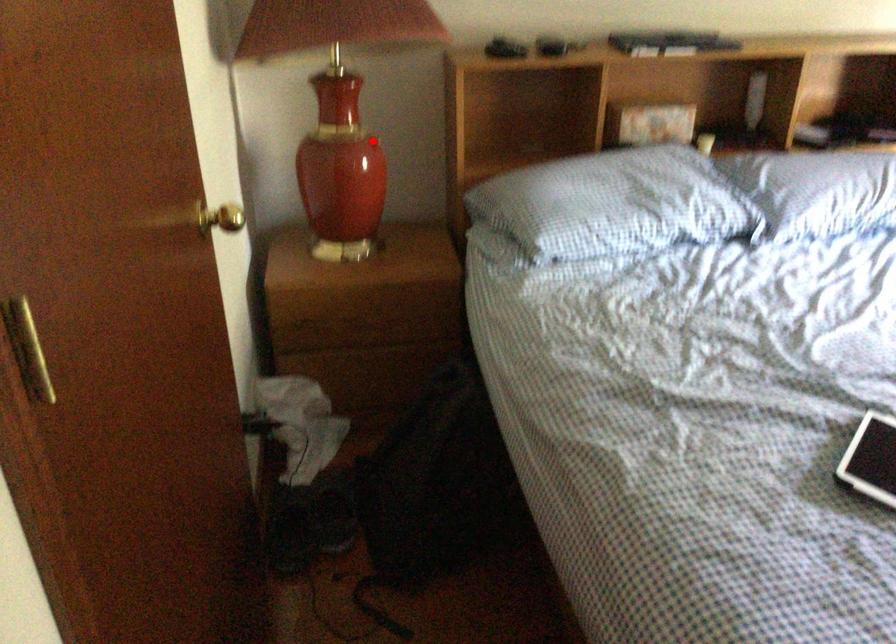
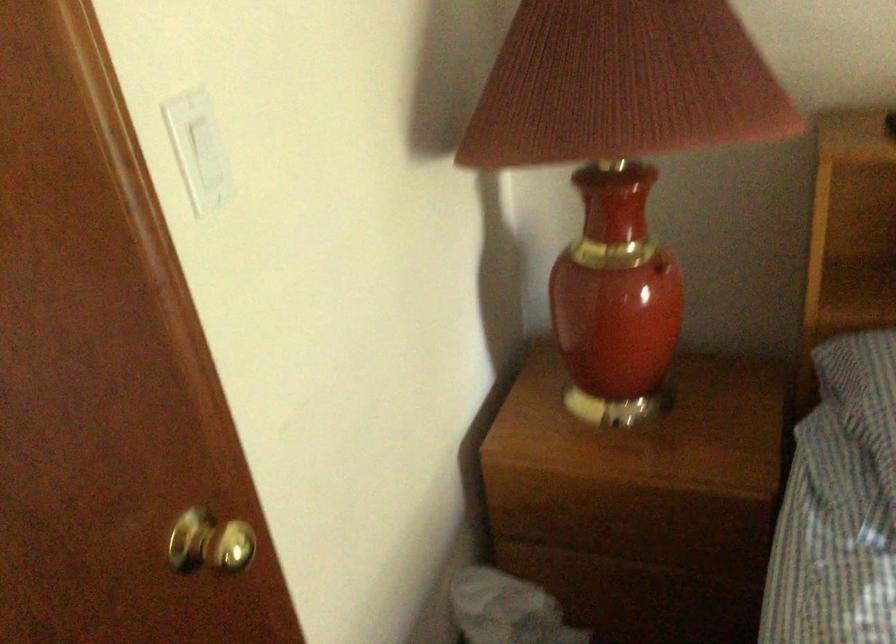
The point at the highlighted location is marked in the first image. Where is the corresponding point in the second image?

(661, 267)